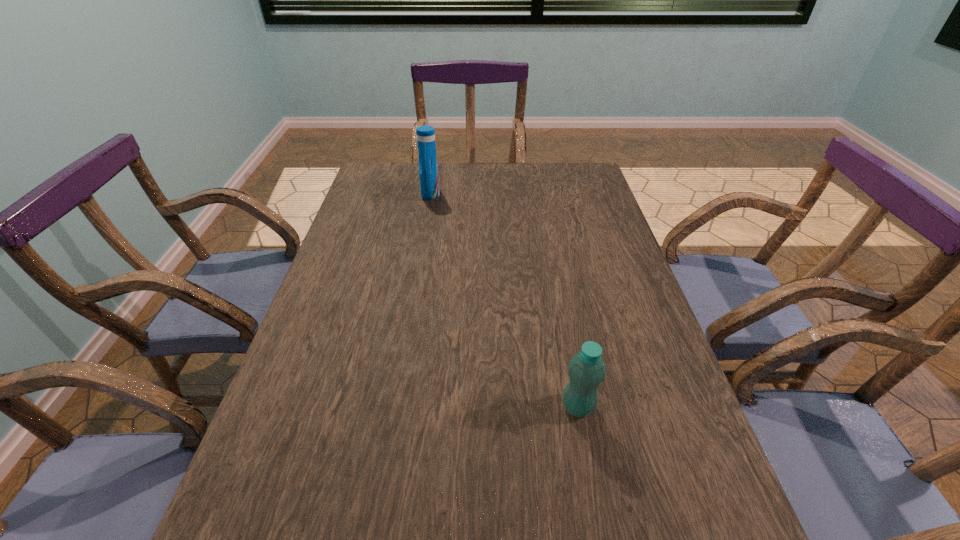
The height and width of the screenshot is (540, 960). What are the coordinates of `vacant space at the left edge of the desktop` in the screenshot? It's located at (333, 442).

Locate an element on the screen. This screenshot has width=960, height=540. vacant space at the right edge of the desktop is located at coordinates (596, 290).

The image size is (960, 540). I want to click on vacant space at the far right corner of the desktop, so click(561, 165).